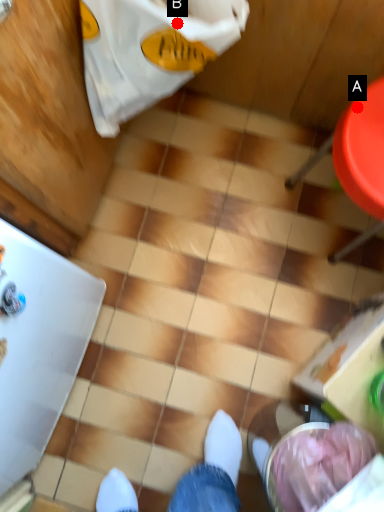
Question: Two points are circled on the image, labeled by A and B beside each circle. Among these points, which one is nearest to the camera?

Choices:
 (A) A is closer
 (B) B is closer

Answer: (B)